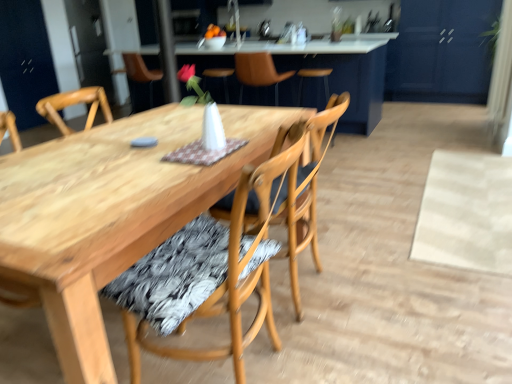
Question: From the image's perspective, relative to blue matte cabinet at upper right, is leather at center, which is the 3th chair in front-to-back order, above or below?

Choices:
 (A) below
 (B) above

Answer: (A)

Question: From a real-world perspective, is leather at center, acting as the first chair starting from the back, positioned above or below blue matte cabinet at upper right?

Choices:
 (A) below
 (B) above

Answer: (A)

Question: Estimate the real-world distances between objects in this image. Which object is closer to the blue matte cabinet at upper right?

Choices:
 (A) wooden table at center
 (B) wooden chair at center, the 2th chair from the front
 (C) wooden chair at center, positioned as the 3th chair in back-to-front order
 (D) leather at center, which is the 3th chair in front-to-back order

Answer: (A)

Question: Which object is the closest to the leather at center, which is the 3th chair in front-to-back order?

Choices:
 (A) wooden chair at center, the 2th chair from the front
 (B) wooden table at center
 (C) blue matte cabinet at upper right
 (D) wooden chair at center, which is the first chair in front-to-back order

Answer: (B)